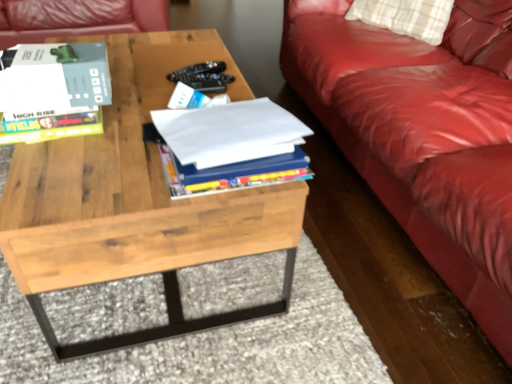
Find the location of a particular element. This screenshot has width=512, height=384. free point above matte gray book at upper left, arranged as the first book when viewed from the left (from a real-world perspective) is located at coordinates (49, 54).